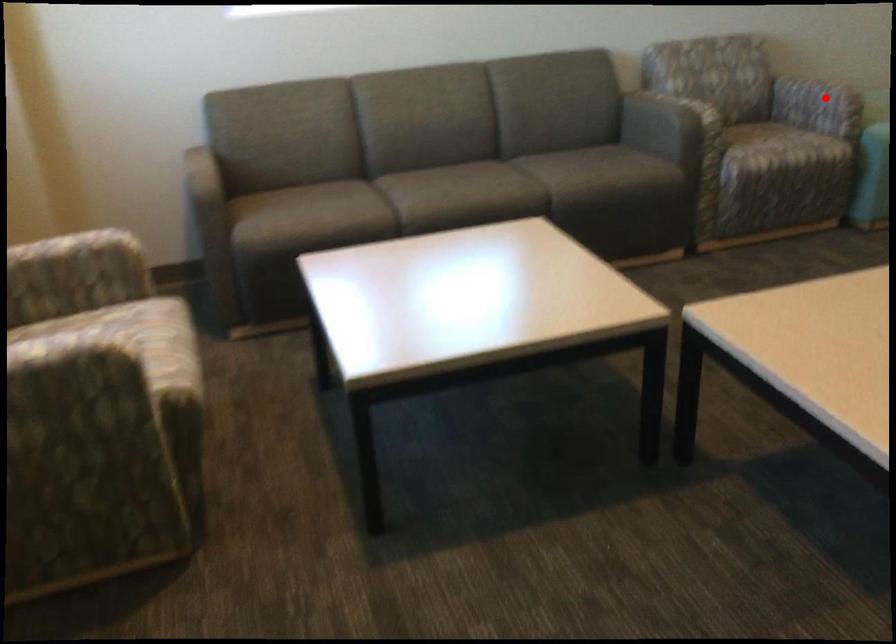
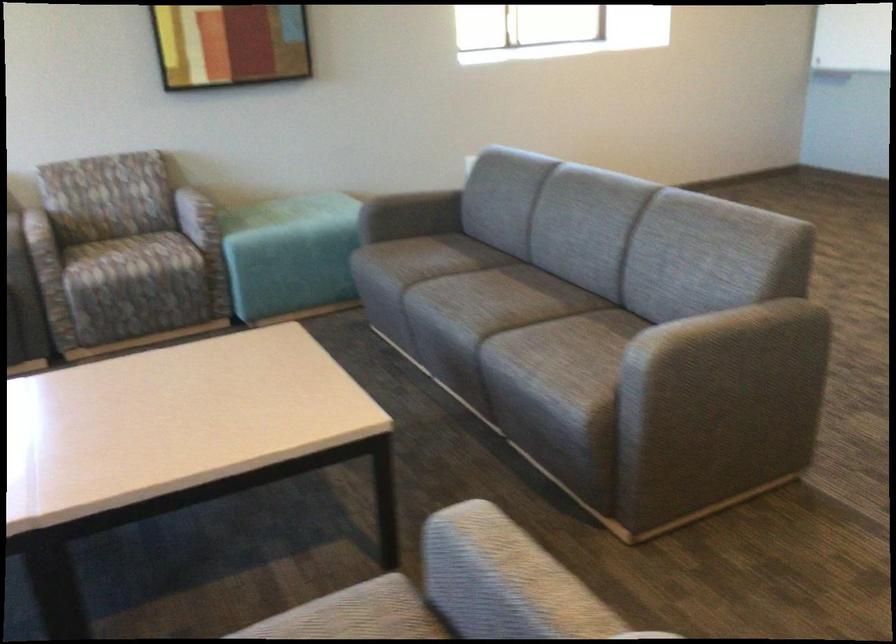
Find the pixel in the second image that matches the highlighted location in the first image.

(197, 216)